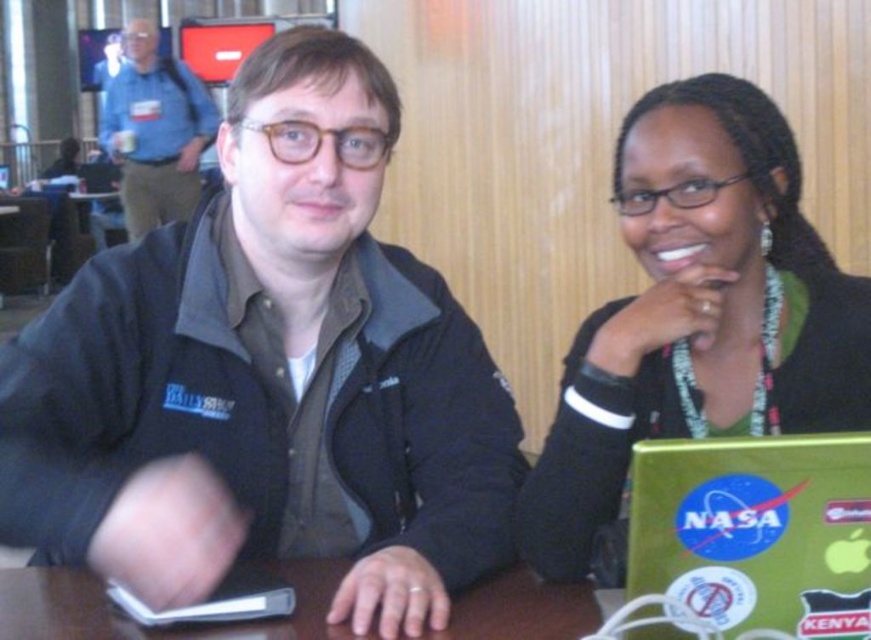
Consider the image. Which is more to the left, green matte laptop at center or brown wooden table at center?

From the viewer's perspective, brown wooden table at center appears more on the left side.

Is green matte laptop at center to the left of brown wooden table at center from the viewer's perspective?

No, green matte laptop at center is not to the left of brown wooden table at center.

Who is more distant from viewer, (566, 417) or (48, 588)?

Point (48, 588)

Image resolution: width=871 pixels, height=640 pixels. Find the location of `green matte laptop at center`. green matte laptop at center is located at coordinates (699, 312).

Is green matte laptop at center wider than blue fabric jacket at upper left?

Incorrect, green matte laptop at center's width does not surpass blue fabric jacket at upper left's.

Which is behind, point (811, 269) or point (188, 93)?

Point (188, 93)

What do you see at coordinates (699, 312) in the screenshot?
I see `green matte laptop at center` at bounding box center [699, 312].

Where is `green matte laptop at center`? Image resolution: width=871 pixels, height=640 pixels. green matte laptop at center is located at coordinates (699, 312).

Can you confirm if black matte jacket at left is wider than brown wooden table at center?

No, black matte jacket at left is not wider than brown wooden table at center.

Who is more forward, (429, 611) or (559, 609)?

Point (429, 611) is more forward.

Does point (262, 179) come in front of point (100, 595)?

No.

Identify the location of black matte jacket at left. The width and height of the screenshot is (871, 640). (268, 376).